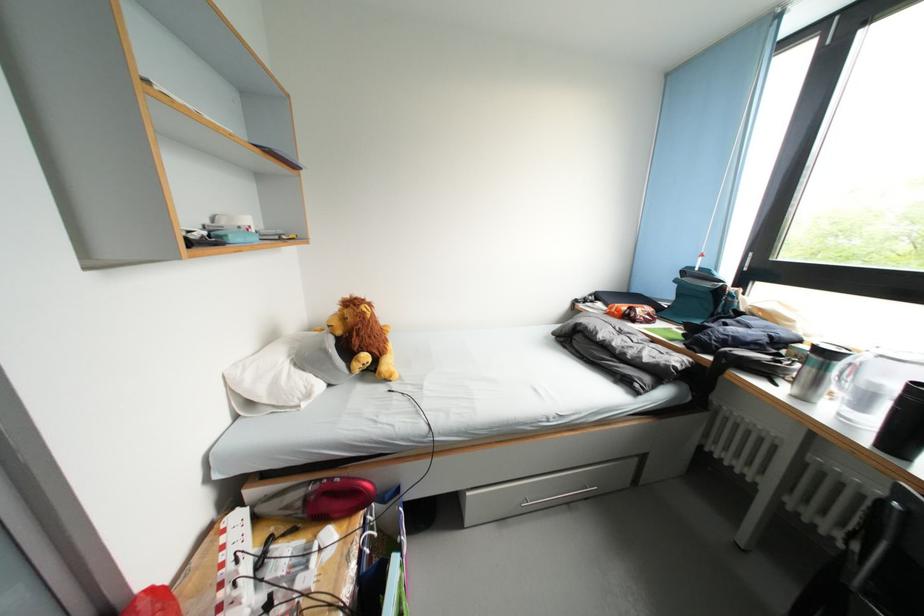
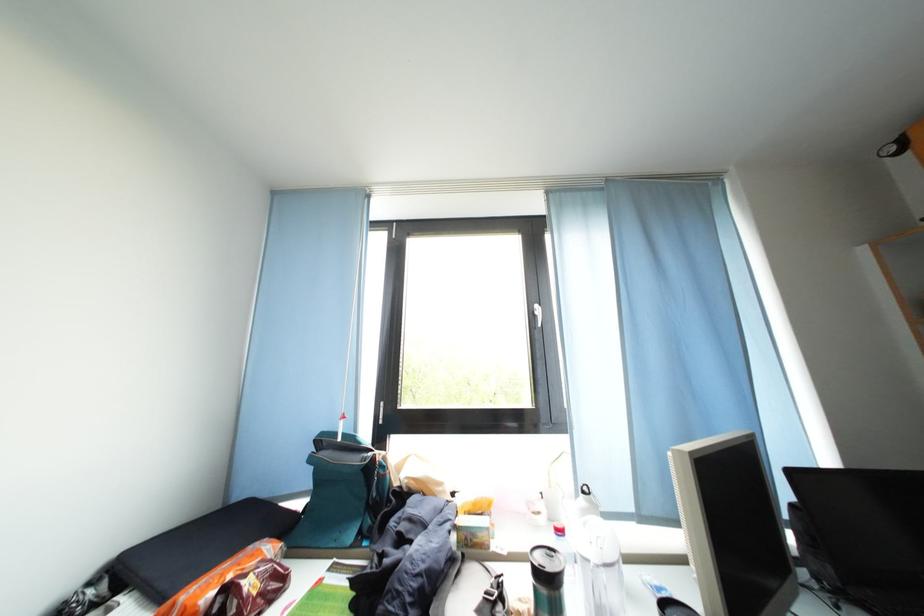
Based on the continuous images, in which direction is the camera rotating?

The rotation direction of the camera is right-up.